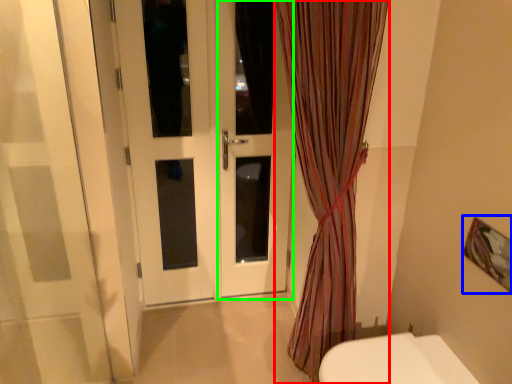
Question: Which object is the closest to the curtain (highlighted by a red box)? Choose among these: picture frame (highlighted by a blue box) or screen door (highlighted by a green box).

Choices:
 (A) picture frame
 (B) screen door

Answer: (B)